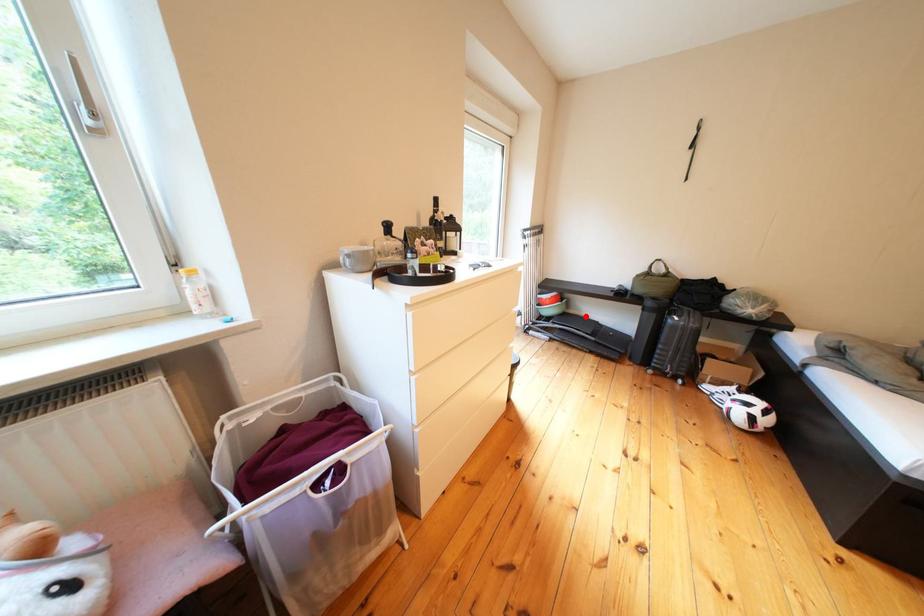
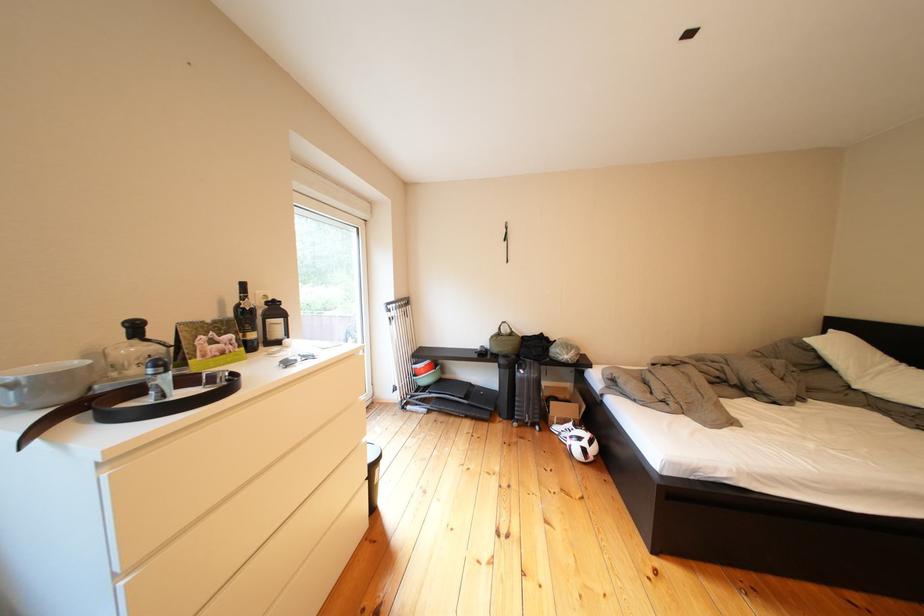
Question: I am providing you with two images of the same scene from different viewpoints. In image1, a red point is highlighted. Considering the same 3D point in image2, which of the following is correct?

Choices:
 (A) It is closer
 (B) It is farther

Answer: (B)